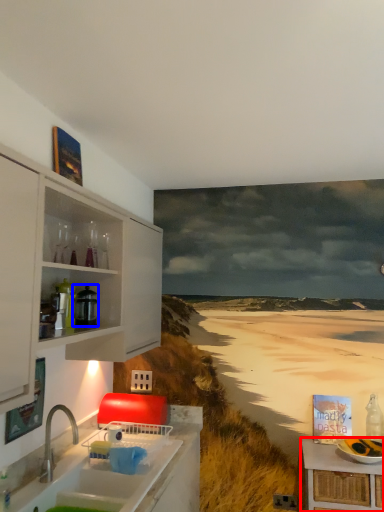
Question: Which object is closer to the camera taking this photo, table (highlighted by a red box) or appliance (highlighted by a blue box)?

Choices:
 (A) table
 (B) appliance

Answer: (A)